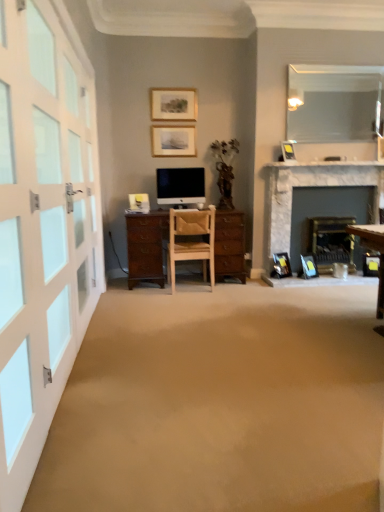
Question: Is matte wooden picture frame at upper center, which is counted as the 5th picture frame, starting from the bottom, wider than blue plastic picture frame at lower right, marked as the 1th picture frame in a bottom-to-top arrangement?

Choices:
 (A) no
 (B) yes

Answer: (A)

Question: Does matte wooden picture frame at upper center, the fifth picture frame when ordered from right to left, have a lesser height compared to blue plastic picture frame at lower right, which appears as the first picture frame when viewed from the right?

Choices:
 (A) no
 (B) yes

Answer: (A)

Question: Is matte wooden picture frame at upper center, arranged as the 1th picture frame when viewed from the top, smaller than blue plastic picture frame at lower right, marked as the 1th picture frame in a bottom-to-top arrangement?

Choices:
 (A) no
 (B) yes

Answer: (A)

Question: From a real-world perspective, is matte wooden picture frame at upper center, which is counted as the 5th picture frame, starting from the bottom, beneath blue plastic picture frame at lower right, marked as the 1th picture frame in a bottom-to-top arrangement?

Choices:
 (A) yes
 (B) no

Answer: (B)

Question: Is matte wooden picture frame at upper center, arranged as the 1th picture frame when viewed from the top, facing towards blue plastic picture frame at lower right, marked as the 1th picture frame in a bottom-to-top arrangement?

Choices:
 (A) yes
 (B) no

Answer: (B)

Question: Considering the positions of white glass door at left and clear glass mirror at upper right in the image, is white glass door at left taller or shorter than clear glass mirror at upper right?

Choices:
 (A) short
 (B) tall

Answer: (B)

Question: Is white glass door at left in front of or behind clear glass mirror at upper right in the image?

Choices:
 (A) front
 (B) behind

Answer: (A)

Question: From a real-world perspective, is white glass door at left positioned above or below clear glass mirror at upper right?

Choices:
 (A) below
 (B) above

Answer: (A)

Question: Choose the correct answer: Is white glass door at left inside clear glass mirror at upper right or outside it?

Choices:
 (A) outside
 (B) inside

Answer: (A)

Question: Is marble fireplace at right wider or thinner than matte black monitor at center?

Choices:
 (A) wide
 (B) thin

Answer: (A)

Question: Considering the positions of point (276, 246) and point (173, 192), is point (276, 246) closer or farther from the camera than point (173, 192)?

Choices:
 (A) farther
 (B) closer

Answer: (B)

Question: Is marble fireplace at right inside or outside of matte black monitor at center?

Choices:
 (A) inside
 (B) outside

Answer: (B)

Question: From their relative heights in the image, would you say marble fireplace at right is taller or shorter than matte black monitor at center?

Choices:
 (A) tall
 (B) short

Answer: (A)

Question: From a real-world perspective, is blue plastic picture frame at lower right, arranged as the 5th picture frame when viewed from the left, physically located above or below matte black picture frame at upper center, placed as the 3th picture frame when sorted from bottom to top?

Choices:
 (A) below
 (B) above

Answer: (A)

Question: From the image's perspective, is blue plastic picture frame at lower right, which is the 5th picture frame from top to bottom, located above or below matte black picture frame at upper center, placed as the 3th picture frame when sorted from bottom to top?

Choices:
 (A) above
 (B) below

Answer: (B)